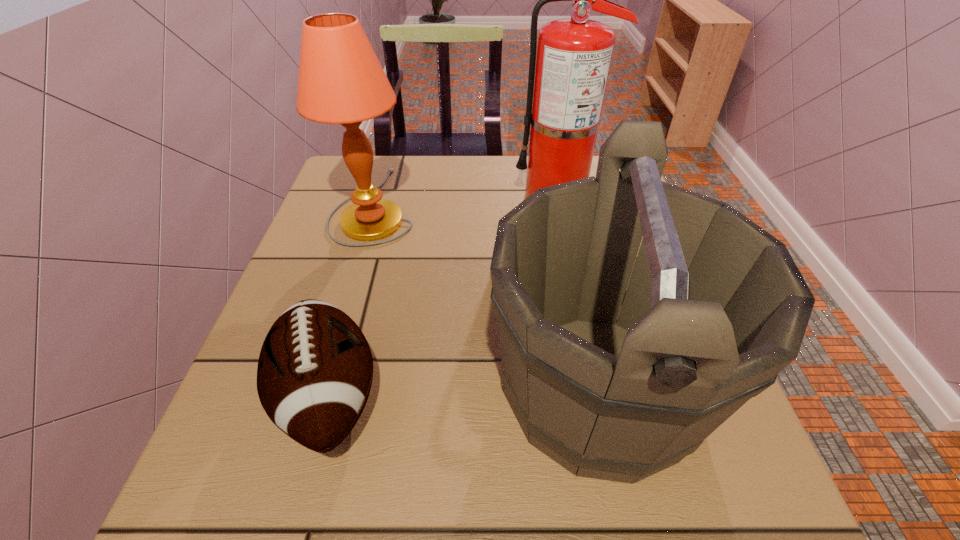
Identify the location of fire extinguisher located in the far edge section of the desktop. The width and height of the screenshot is (960, 540). (573, 60).

You are a GUI agent. You are given a task and a screenshot of the screen. Output one action in this format:
    pyautogui.click(x=<x>, y=<y>)
    Task: Click on the lamp that is at the far edge
    The width and height of the screenshot is (960, 540).
    Given the screenshot: What is the action you would take?
    pyautogui.click(x=341, y=81)

The image size is (960, 540). I want to click on bucket that is at the near edge, so pos(715,308).

You are a GUI agent. You are given a task and a screenshot of the screen. Output one action in this format:
    pyautogui.click(x=<x>, y=<y>)
    Task: Click on the football (American) situated at the near edge
    
    Given the screenshot: What is the action you would take?
    pyautogui.click(x=315, y=369)

Identify the location of lamp present at the left edge. This screenshot has height=540, width=960. (341, 81).

Locate an element on the screen. This screenshot has width=960, height=540. football (American) that is at the left edge is located at coordinates (315, 369).

Find the location of `fire extinguisher that is at the right edge`. fire extinguisher that is at the right edge is located at coordinates (573, 60).

The height and width of the screenshot is (540, 960). In order to click on bucket that is at the right edge in this screenshot , I will do `click(715, 308)`.

At what (x,y) coordinates should I click in order to perform the action: click on object that is at the far left corner. Please return your answer as a coordinate pair (x, y). Looking at the image, I should click on (341, 81).

This screenshot has width=960, height=540. In order to click on object situated at the near left corner in this screenshot , I will do `click(315, 369)`.